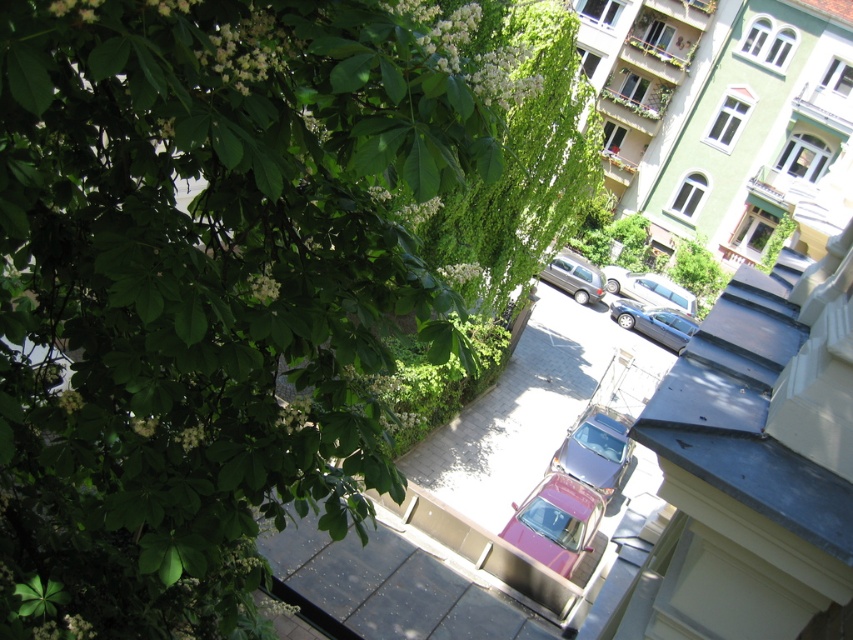
You are a delivery person with a cart that is 2 meters wide. You need to navigate between the shiny red car at center and the metallic silver car at center. Can your cart fit through the space between them?

The distance between the shiny red car at center and the metallic silver car at center is 1.99 meters. Since your cart is 2 meters wide, it cannot fit through the space between them.

You are a delivery person trying to park a new metallic blue sedan at center in a parking spot that can only accommodate vehicles up to the height of the satin silver van at center. Can your sedan fit in the spot?

The metallic blue sedan at center is much taller than the satin silver van at center, so it cannot fit in the parking spot designed for the van.